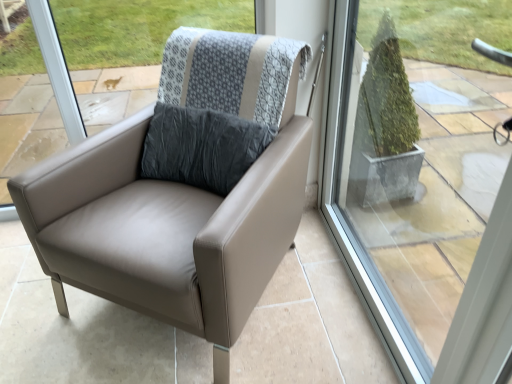
Question: Is matte leather chair at center to the left or to the right of transparent glass window at center in the image?

Choices:
 (A) right
 (B) left

Answer: (B)

Question: From a real-world perspective, is matte leather chair at center positioned above or below transparent glass window at center?

Choices:
 (A) above
 (B) below

Answer: (B)

Question: Considering the positions of matte leather chair at center and transparent glass window at center in the image, is matte leather chair at center taller or shorter than transparent glass window at center?

Choices:
 (A) short
 (B) tall

Answer: (A)

Question: Visually, is transparent glass window at center positioned to the left or to the right of matte leather chair at center?

Choices:
 (A) left
 (B) right

Answer: (B)

Question: Would you say transparent glass window at center is inside or outside matte leather chair at center?

Choices:
 (A) outside
 (B) inside

Answer: (A)

Question: Considering the positions of transparent glass window at center and matte leather chair at center in the image, is transparent glass window at center taller or shorter than matte leather chair at center?

Choices:
 (A) tall
 (B) short

Answer: (A)

Question: Is point (398, 109) closer or farther from the camera than point (305, 152)?

Choices:
 (A) farther
 (B) closer

Answer: (A)